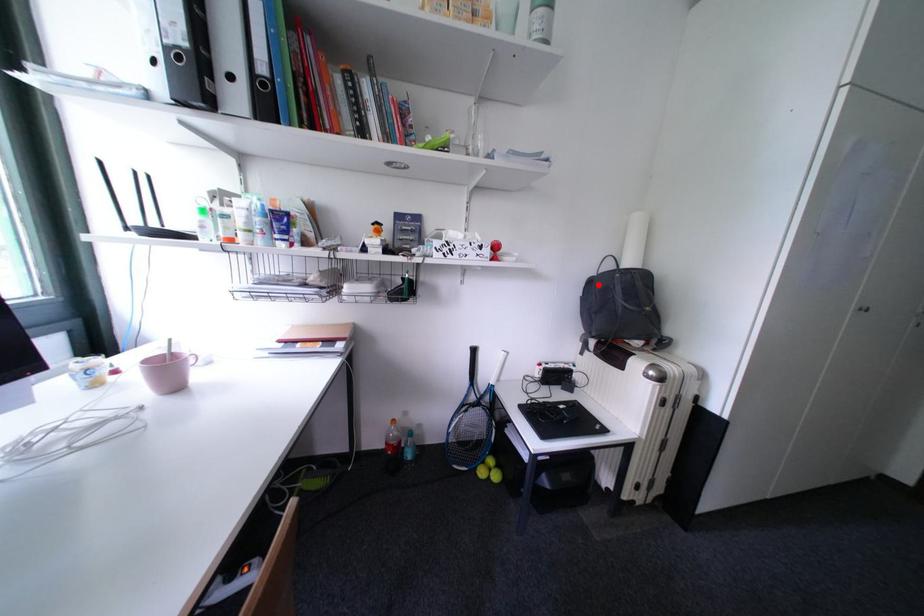
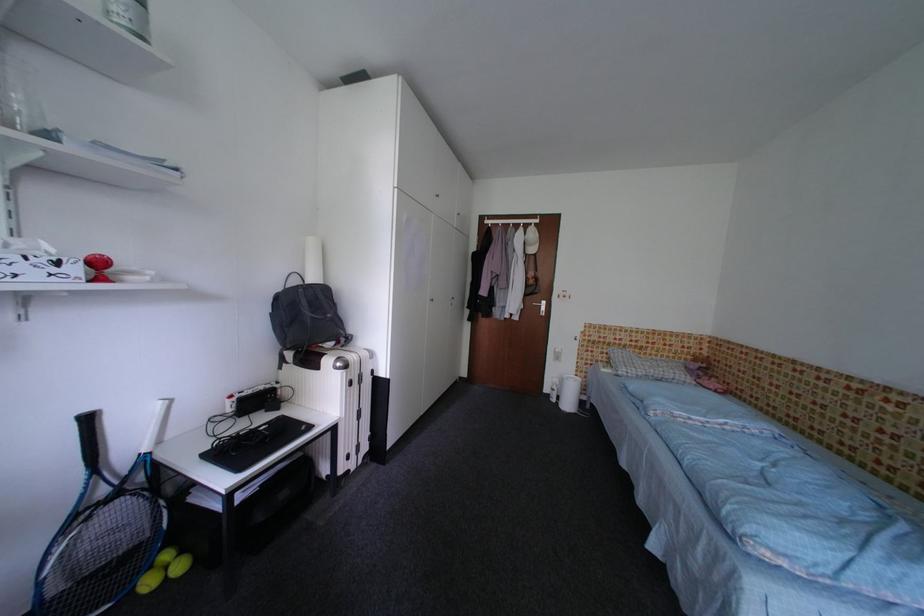
Locate, in the second image, the point that corresponds to the highlighted location in the first image.

(286, 301)